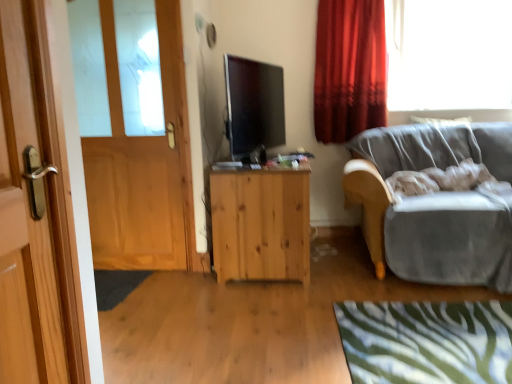
At what (x,y) coordinates should I click in order to perform the action: click on free space in front of wooden door at left, which is the first door from back to front. Please return your answer as a coordinate pair (x, y). Looking at the image, I should click on (138, 287).